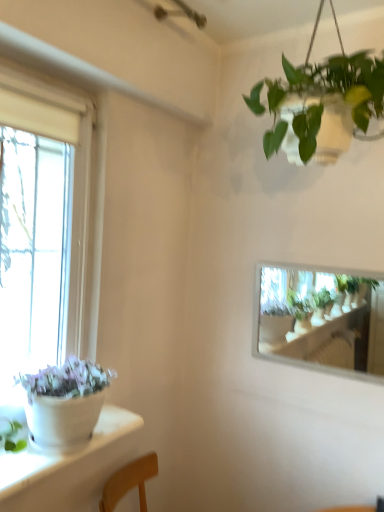
Question: Considering the positions of point (322, 291) and point (345, 93), is point (322, 291) closer or farther from the camera than point (345, 93)?

Choices:
 (A) farther
 (B) closer

Answer: (A)

Question: Considering the positions of green matte plant at upper right, which appears as the first houseplant when viewed from the back, and green leafy plant at upper center, which is the second houseplant from back to front, in the image, is green matte plant at upper right, which appears as the first houseplant when viewed from the back, bigger or smaller than green leafy plant at upper center, which is the second houseplant from back to front,?

Choices:
 (A) small
 (B) big

Answer: (A)

Question: From a real-world perspective, is green matte plant at upper right, which is the 2th houseplant from top to bottom, above or below green leafy plant at upper center, which appears as the first houseplant when viewed from the top?

Choices:
 (A) above
 (B) below

Answer: (B)

Question: Considering the positions of point [314, 75] and point [276, 292], is point [314, 75] closer or farther from the camera than point [276, 292]?

Choices:
 (A) closer
 (B) farther

Answer: (A)

Question: Is green leafy plant at upper center, which is the second houseplant in bottom-to-top order, bigger or smaller than green matte plant at upper right, the second houseplant in the front-to-back sequence?

Choices:
 (A) small
 (B) big

Answer: (B)

Question: From the image's perspective, relative to green matte plant at upper right, the second houseplant in the front-to-back sequence, is green leafy plant at upper center, which is the second houseplant in bottom-to-top order, above or below?

Choices:
 (A) above
 (B) below

Answer: (A)

Question: Is green leafy plant at upper center, positioned as the first houseplant in front-to-back order, inside or outside of green matte plant at upper right, the second houseplant in the front-to-back sequence?

Choices:
 (A) outside
 (B) inside

Answer: (A)